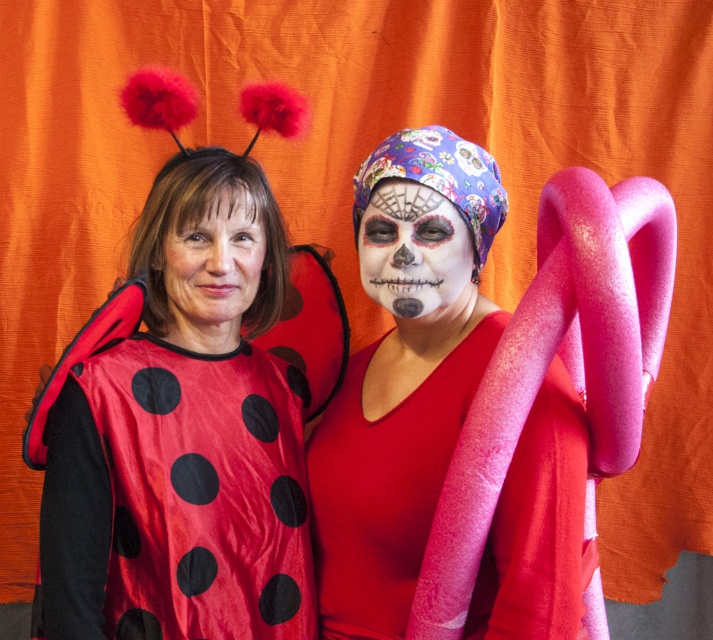
Can you confirm if white painted skull at center is shorter than smooth matte skin at center?

Indeed, white painted skull at center has a lesser height compared to smooth matte skin at center.

Which of these two, white painted skull at center or smooth matte skin at center, stands taller?

With more height is smooth matte skin at center.

Image resolution: width=713 pixels, height=640 pixels. I want to click on white painted skull at center, so click(x=416, y=253).

Does matte pink foam antennae at center have a greater height compared to white painted skull at center?

Yes, matte pink foam antennae at center is taller than white painted skull at center.

Does matte pink foam antennae at center have a smaller size compared to white painted skull at center?

No.

In order to click on matte pink foam antennae at center in this screenshot , I will do `click(404, 372)`.

In the scene shown: Does matte fabric ladybug costume at left come in front of matte pink foam antennae at center?

No, it is behind matte pink foam antennae at center.

Is matte fabric ladybug costume at left wider than matte pink foam antennae at center?

No, matte fabric ladybug costume at left is not wider than matte pink foam antennae at center.

Is point (112, 497) in front of point (391, 420)?

Yes, point (112, 497) is in front of point (391, 420).

Find the location of a particular element. The height and width of the screenshot is (640, 713). matte fabric ladybug costume at left is located at coordinates (185, 435).